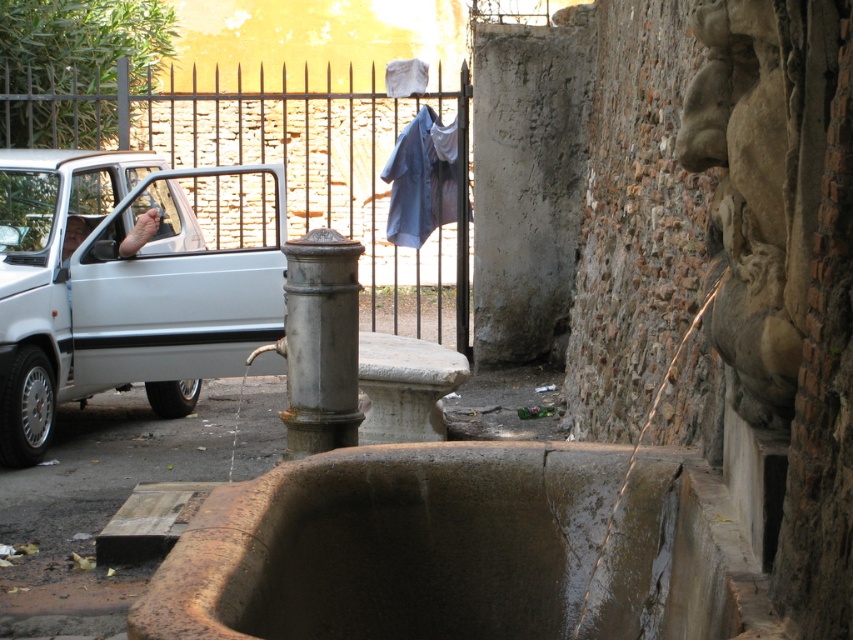
You are standing in front of the fountain and want to exit through the gate. Which direction should you walk to reach the metallic iron gate at upper center from the fountain?

You should walk towards the upper center direction to reach the metallic iron gate at upper center from the fountain.

You are standing at the center of the image. Which direction should you walk to reach the white matte car at left?

You should walk to the left to reach the white matte car at left since it is located at point [128,282], which is to the left side of the image.